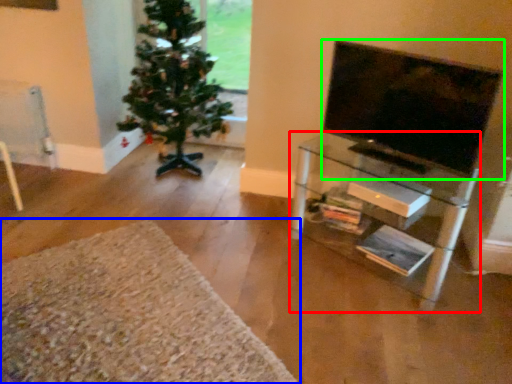
Question: Based on their relative distances, which object is farther from shelf (highlighted by a red box)? Choose from plain (highlighted by a blue box) and television (highlighted by a green box).

Choices:
 (A) plain
 (B) television

Answer: (A)